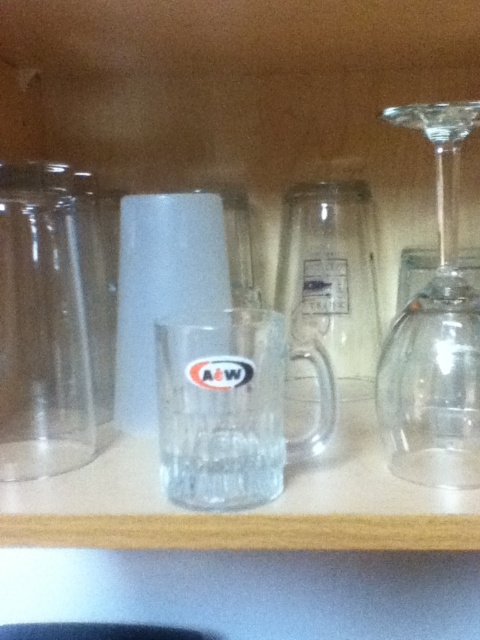
From the picture: Between transparent glass vase at left and transparent glass wine glass at right, which one has more height?

transparent glass wine glass at right

Is point (92, 381) farther from camera compared to point (406, 342)?

Yes, it is behind point (406, 342).

Where is `transparent glass vase at left`? The width and height of the screenshot is (480, 640). transparent glass vase at left is located at coordinates click(x=43, y=326).